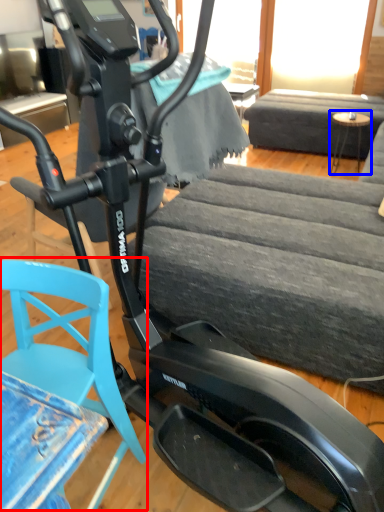
Question: Which point is closer to the camera, swivel chair (highlighted by a red box) or table (highlighted by a blue box)?

Choices:
 (A) swivel chair
 (B) table

Answer: (A)